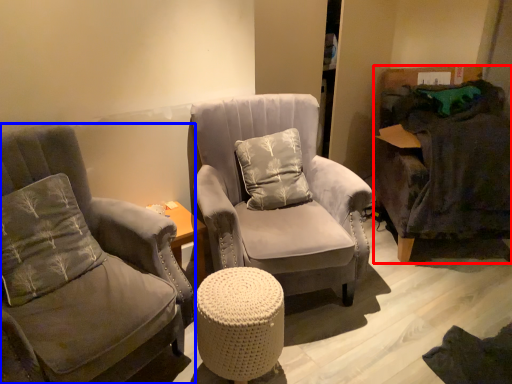
Question: Among these objects, which one is nearest to the camera, swivel chair (highlighted by a red box) or chair (highlighted by a blue box)?

Choices:
 (A) swivel chair
 (B) chair

Answer: (B)